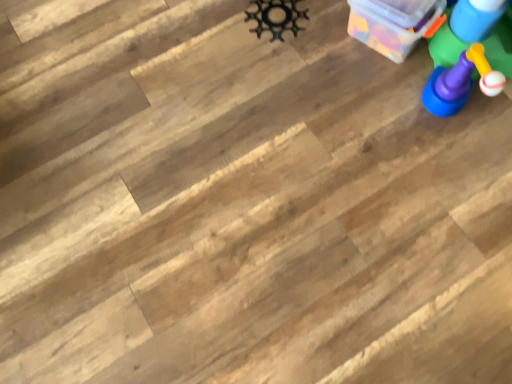
At what (x,y) coordinates should I click in order to perform the action: click on free space above black metal gear at upper center, which is counted as the 1th toy, starting from the left (from a real-world perspective). Please return your answer as a coordinate pair (x, y). Looking at the image, I should click on 277,24.